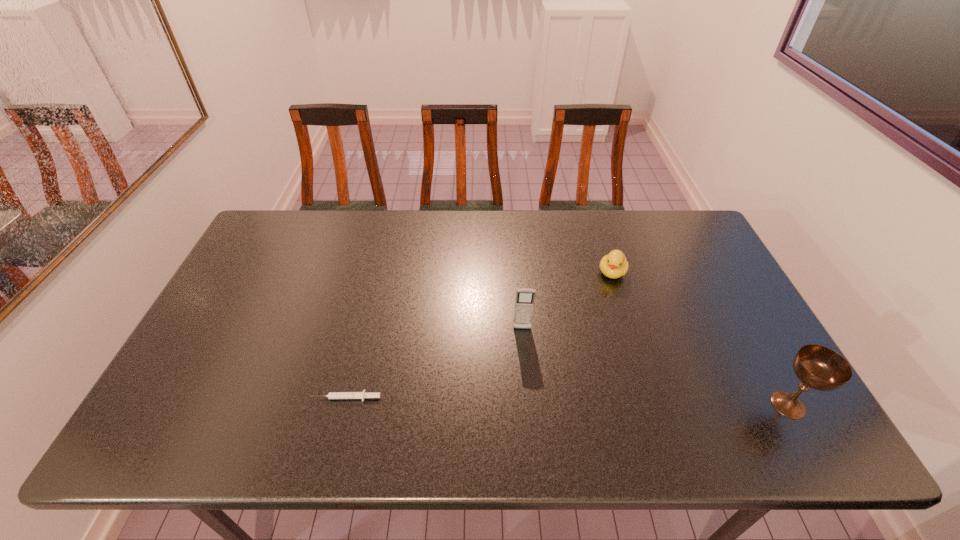
Identify the location of vacant point located between the leftmost object and the cellular telephone. This screenshot has height=540, width=960. (434, 363).

In order to click on free spot between the third object from right to left and the third tallest object in this screenshot , I will do `click(567, 301)`.

Find the location of a particular element. The width and height of the screenshot is (960, 540). vacant space that's between the shortest object and the chalice is located at coordinates (567, 401).

Where is `vacant area that lies between the syringe and the third object from left to right`? The image size is (960, 540). vacant area that lies between the syringe and the third object from left to right is located at coordinates (479, 335).

Locate which object ranks in proximity to the rightmost object. Please provide its 2D coordinates. Your answer should be formatted as a tuple, i.e. [(x, y)], where the tuple contains the x and y coordinates of a point satisfying the conditions above.

[(614, 265)]

You are a GUI agent. You are given a task and a screenshot of the screen. Output one action in this format:
    pyautogui.click(x=<x>, y=<y>)
    Task: Click on the object that is the closest to the syringe
    
    Given the screenshot: What is the action you would take?
    pyautogui.click(x=524, y=302)

You are a GUI agent. You are given a task and a screenshot of the screen. Output one action in this format:
    pyautogui.click(x=<x>, y=<y>)
    Task: Click on the vacant point that satisfies the following two spatial constraints: 1. on the back side of the farthest object; 2. on the left side of the second farthest object
    
    Given the screenshot: What is the action you would take?
    pyautogui.click(x=517, y=272)

What are the coordinates of `vacant area that satisfies the following two spatial constraints: 1. on the front side of the rightmost object; 2. on the left side of the leftmost object` in the screenshot? It's located at (345, 405).

Locate an element on the screen. The image size is (960, 540). blank space that satisfies the following two spatial constraints: 1. on the back side of the leftmost object; 2. on the left side of the second object from right to left is located at coordinates (376, 272).